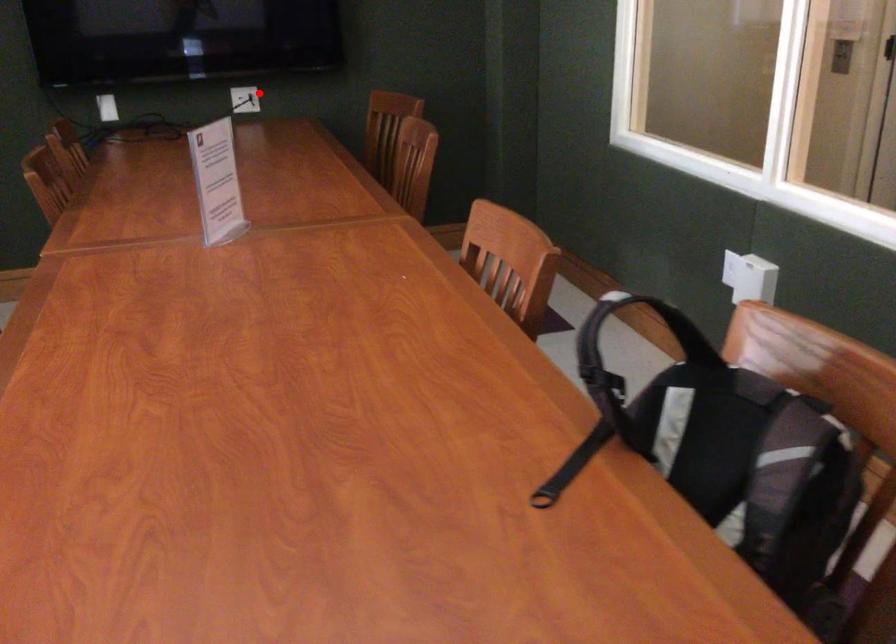
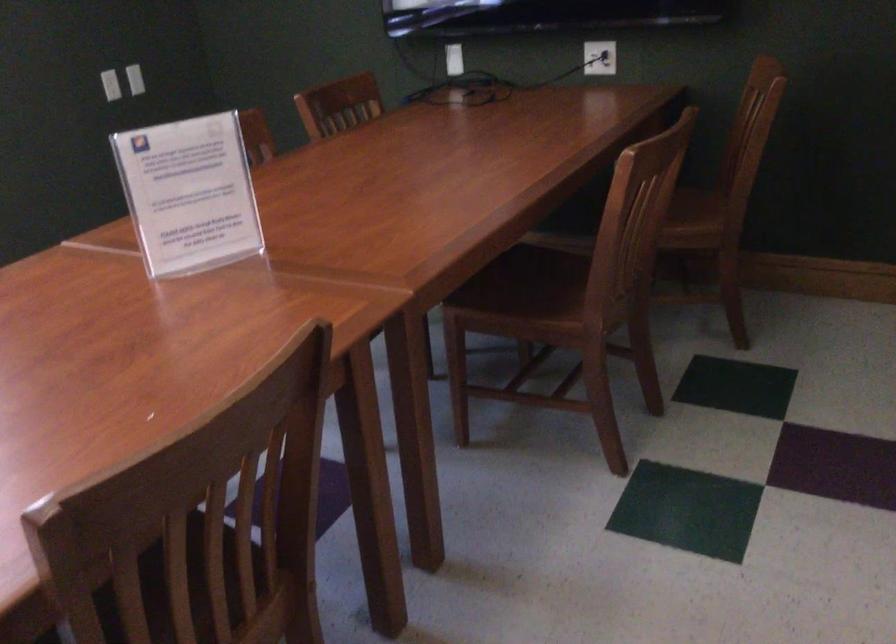
Where in the second image is the point corresponding to the highlighted location from the first image?

(599, 58)